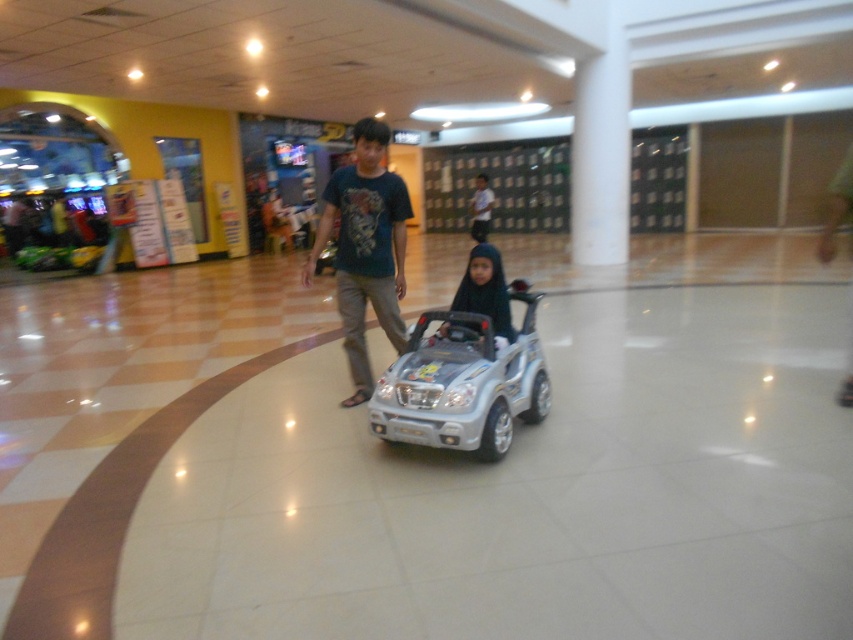
What do you see at coordinates (463, 381) in the screenshot? I see `silver metallic toy car at center` at bounding box center [463, 381].

Between point (520, 360) and point (490, 257), which one is positioned behind?

Point (490, 257)

At what (x,y) coordinates should I click in order to perform the action: click on silver metallic toy car at center. Please return your answer as a coordinate pair (x, y). This screenshot has height=640, width=853. Looking at the image, I should click on (463, 381).

Can you confirm if silver metallic toy car at center is positioned to the right of dark blue t-shirt at center?

Yes, silver metallic toy car at center is to the right of dark blue t-shirt at center.

Which of these two, silver metallic toy car at center or dark blue t-shirt at center, stands taller?

dark blue t-shirt at center is taller.

Image resolution: width=853 pixels, height=640 pixels. What are the coordinates of `silver metallic toy car at center` in the screenshot? It's located at (463, 381).

Is point (474, 266) closer to viewer compared to point (477, 179)?

Yes, it is.

How much distance is there between dark blue fabric hijab at center and matte blue shirt at center?

dark blue fabric hijab at center and matte blue shirt at center are 9.15 meters apart from each other.

Is point (492, 291) closer to camera compared to point (482, 189)?

Yes, point (492, 291) is closer to viewer.

I want to click on dark blue fabric hijab at center, so 486,291.